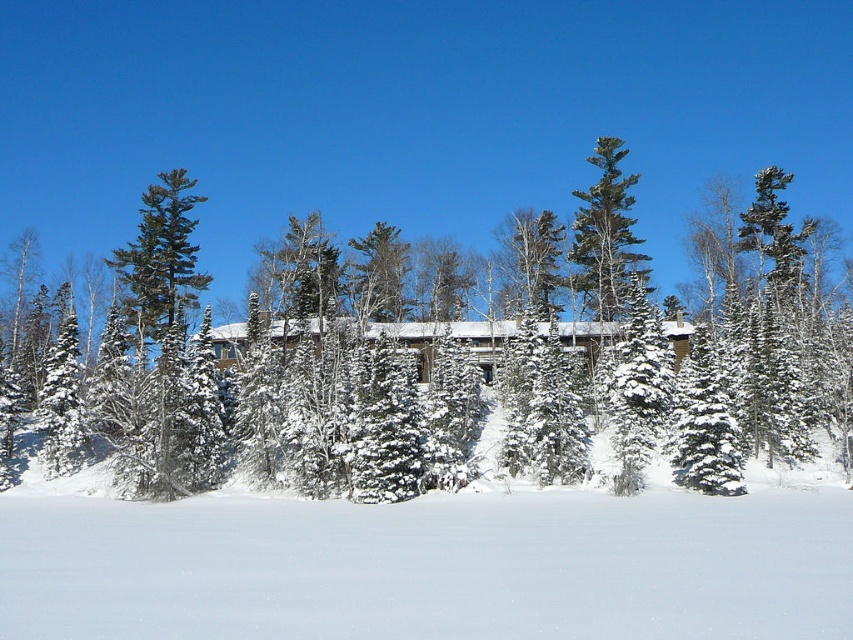
You are standing in the winter landscape and want to take a photo of the green textured pine tree at upper center without the white fluffy snow at lower center blocking the view. Is it possible to do so from your current position?

Yes, because the white fluffy snow at lower center is in front of the green textured pine tree at upper center, you can move slightly to the side or adjust your angle to capture the pine tree without the snow blocking the view.

You are standing in the winter landscape and want to take a photo of the green textured pine tree at upper center. To avoid having the white fluffy snow at lower center in the foreground, where should you position yourself relative to the tree?

You should position yourself behind the green textured pine tree at upper center so that the tree is between you and the white fluffy snow at lower center, thus blocking the snow from the foreground of your photo.